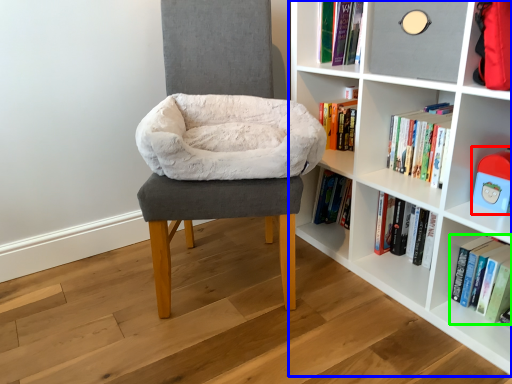
Question: Considering the real-world distances, which object is closest to toy (highlighted by a red box)? shelf (highlighted by a blue box) or book (highlighted by a green box).

Choices:
 (A) shelf
 (B) book

Answer: (B)